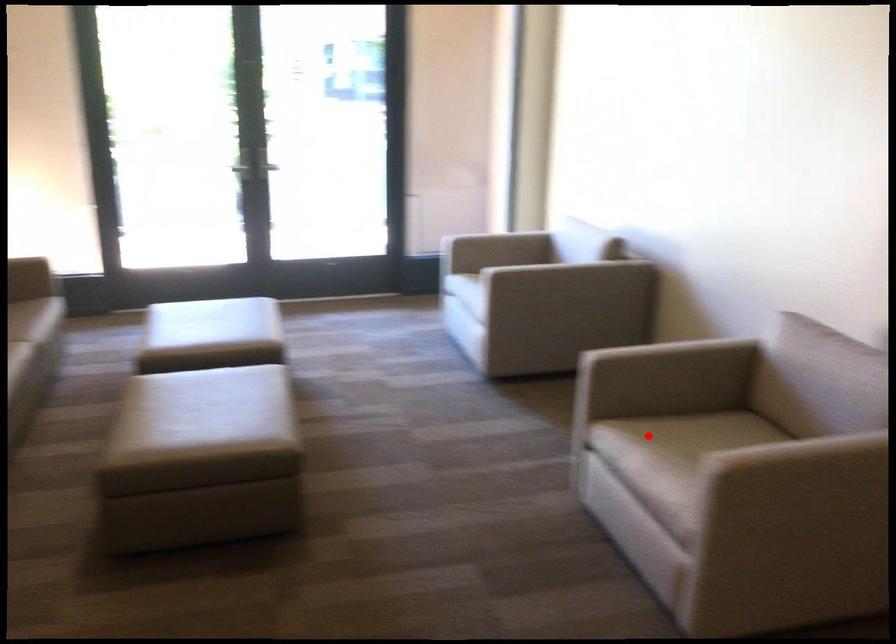
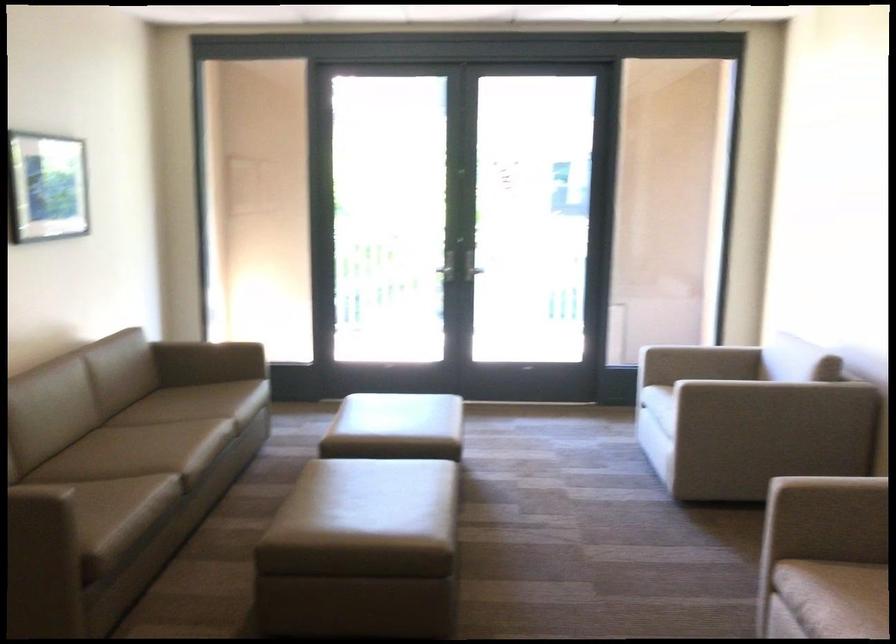
In the second image, find the point that corresponds to the highlighted location in the first image.

(856, 591)